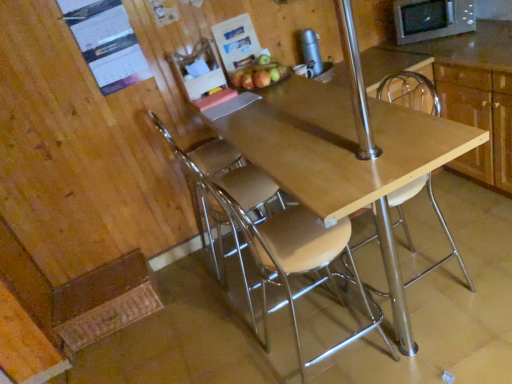
You are a GUI agent. You are given a task and a screenshot of the screen. Output one action in this format:
    pyautogui.click(x=<x>, y=<y>)
    Task: Click on the vacant space to the right of wooden seat at center, which appears as the 2th chair when viewed from the right
    The image size is (512, 384).
    Given the screenshot: What is the action you would take?
    pyautogui.click(x=433, y=346)